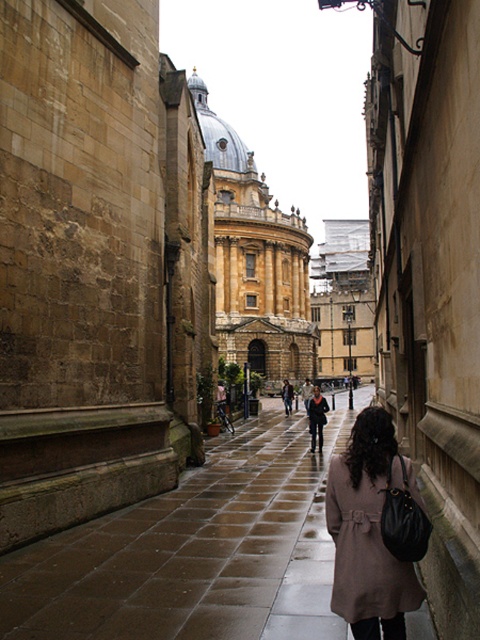
Question: Is golden stone dome at center positioned behind brown matte trench coat at lower right?

Choices:
 (A) yes
 (B) no

Answer: (A)

Question: Can you confirm if brown matte trench coat at lower right is wider than matte black coat at center?

Choices:
 (A) no
 (B) yes

Answer: (A)

Question: Can you confirm if brown matte trench coat at lower right is thinner than matte black coat at center?

Choices:
 (A) yes
 (B) no

Answer: (A)

Question: Which is nearer to the matte black coat at center?

Choices:
 (A) brown matte trench coat at lower right
 (B) golden stone dome at center

Answer: (A)

Question: Which of the following is the farthest from the observer?

Choices:
 (A) (322, 429)
 (B) (392, 540)

Answer: (A)

Question: Which of the following is the farthest from the observer?

Choices:
 (A) golden stone dome at center
 (B) matte black coat at center
 (C) brown matte trench coat at lower right

Answer: (A)